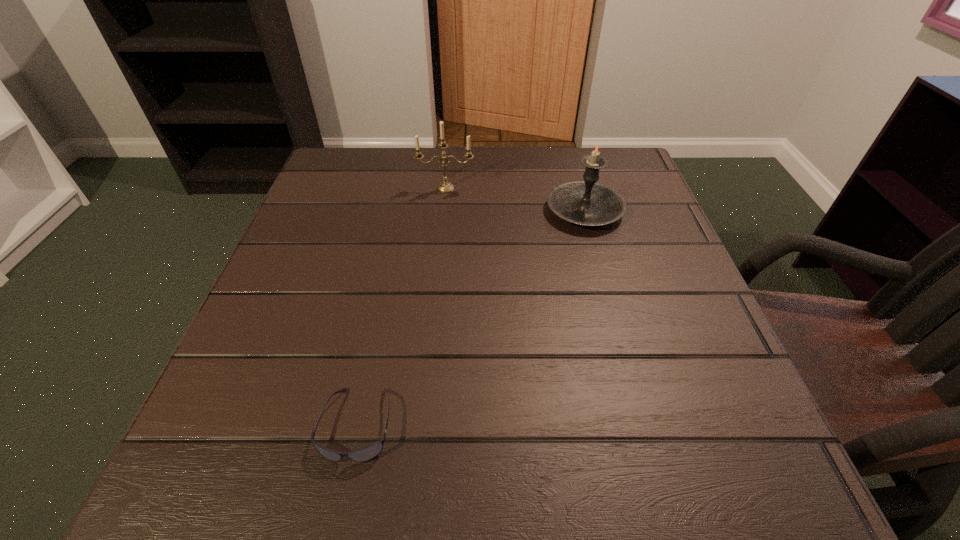
The height and width of the screenshot is (540, 960). What are the coordinates of `empty space between the rightmost object and the left candle` in the screenshot? It's located at (515, 199).

Identify the location of vacant area that lies between the sunglasses and the left candle. click(401, 306).

At what (x,y) coordinates should I click in order to perform the action: click on vacant area that lies between the rightmost object and the shortest object. Please return your answer as a coordinate pair (x, y). Looking at the image, I should click on (470, 318).

At what (x,y) coordinates should I click in order to perform the action: click on free space that is in between the right candle and the left candle. Please return your answer as a coordinate pair (x, y). Looking at the image, I should click on (515, 199).

Identify which object is the second nearest to the shortest object. Please provide its 2D coordinates. Your answer should be formatted as a tuple, i.e. [(x, y)], where the tuple contains the x and y coordinates of a point satisfying the conditions above.

[(445, 186)]

Locate an element on the screen. object that ranks as the second closest to the right candle is located at coordinates (366, 453).

The image size is (960, 540). Identify the location of free space that satisfies the following two spatial constraints: 1. on the front side of the rightmost object; 2. on the right side of the left candle. (444, 211).